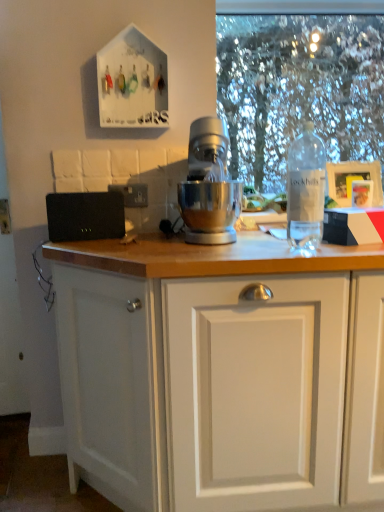
Question: From the image's perspective, is black plastic electric outlet at upper left above or below clear plastic bottle at right?

Choices:
 (A) above
 (B) below

Answer: (B)

Question: From a real-world perspective, is black plastic electric outlet at upper left above or below clear plastic bottle at right?

Choices:
 (A) below
 (B) above

Answer: (A)

Question: Which object is the closest to the clear plastic bottle at right?

Choices:
 (A) black plastic electric outlet at upper left
 (B) clear plastic bottle at right
 (C) silver metallic mixer at center

Answer: (C)

Question: Which object is the closest to the clear plastic bottle at right?

Choices:
 (A) silver metallic mixer at center
 (B) black plastic electric outlet at upper left
 (C) clear plastic bottle at right

Answer: (A)